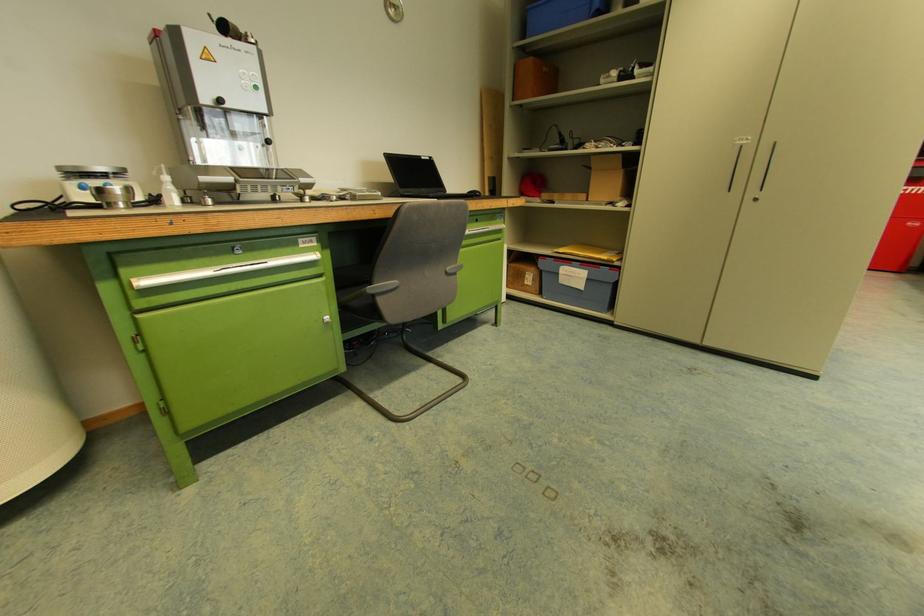
Locate an element on the screen. The height and width of the screenshot is (616, 924). small metal bowl is located at coordinates (113, 195).